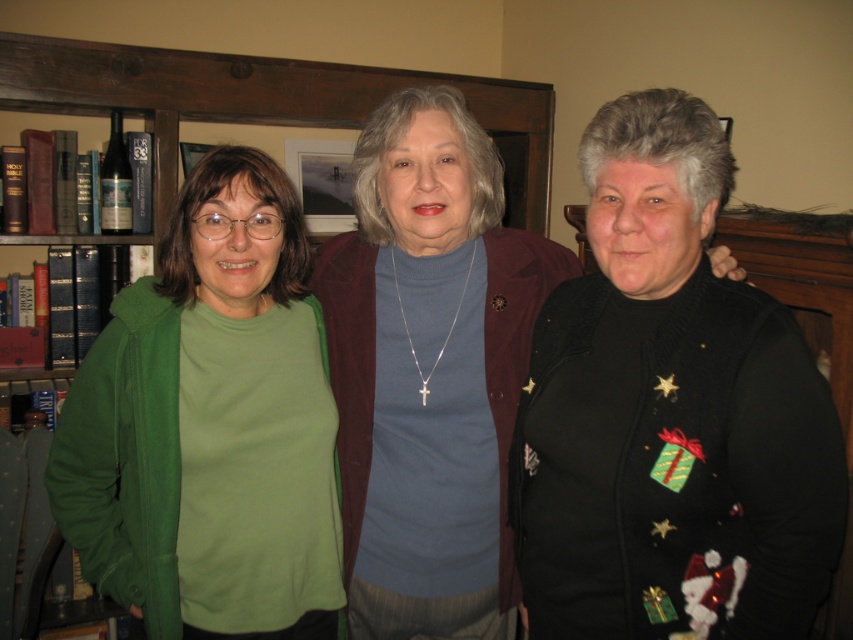
You are a delivery person who needs to place a package between the black fuzzy sweater at right and the wooden bookshelf at upper left. The package is 5 feet long. Will it fit in the space between them?

The distance between the black fuzzy sweater at right and the wooden bookshelf at upper left is 4.58 feet. Since the package is 5 feet long, it will not fit in the space between them.

You are standing in the room and want to move from the point at coordinates (x=670, y=426) to the point at coordinates (x=155, y=205). Is the path between these two points clear of any obstacles?

The point at coordinates (x=670, y=426) is in front of the point at coordinates (x=155, y=205), so the path between them is clear of any obstacles.

You are a photographer standing 1.5 meters away from the camera. You want to adjust the green fleece jacket at left so that it is closer to the camera. How much distance do you need to move it forward?

The green fleece jacket at left is currently 1.19 meters away from the camera. To move it closer to the camera, you need to reduce the distance between them. Since you are 1.5 meters away from the camera, you can move the jacket forward by the desired amount, but the exact distance required depends on how close you want it to be. However, based on the given information, the jacket is already 1.19 meters from the camera, so if you want it to be, say, 1 meter away, you would move it forward by 0.19 meters.